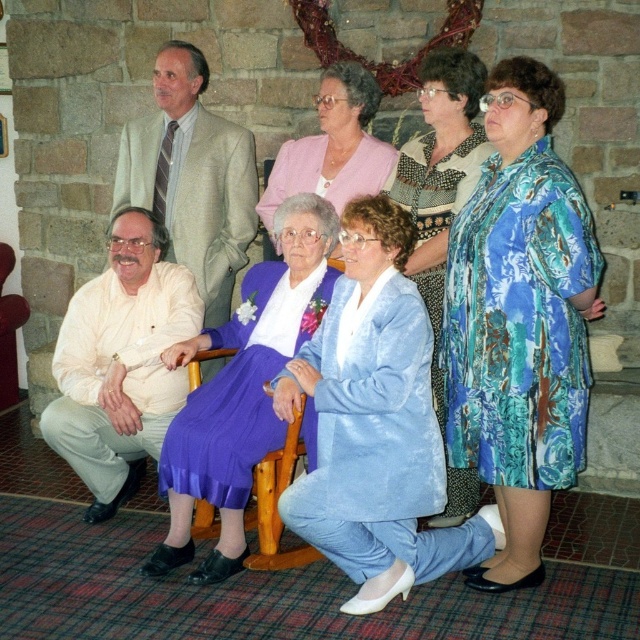
You are organizing a photo shoot and need to position two models wearing the floral print dress at right and the pink satin dress at center. According to the scene, which dress is positioned more to the east side of the room?

The floral print dress at right is positioned more to the east side of the room because it is to the right of the pink satin dress at center, assuming the scene is viewed from the front with right corresponding to east.